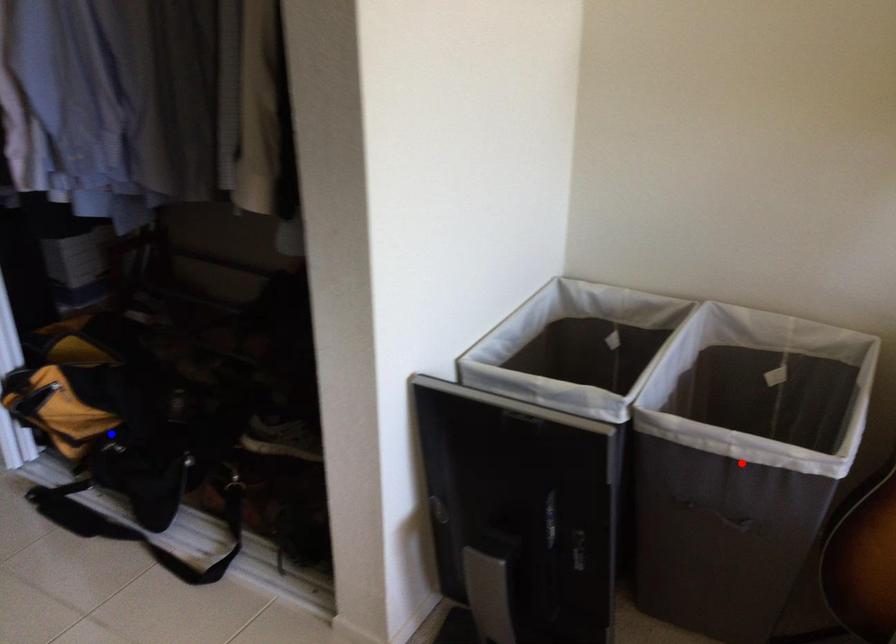
Question: Two points are marked on the image. Which point is closer to the camera?

Choices:
 (A) Blue point is closer.
 (B) Red point is closer.

Answer: (B)